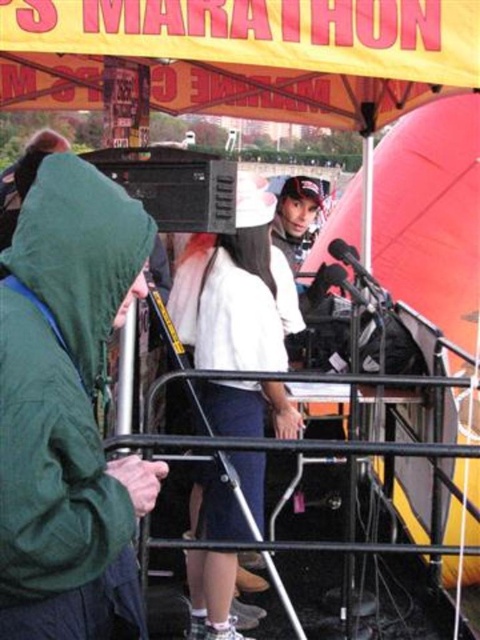
Question: Which point is farther to the camera?

Choices:
 (A) (284, 349)
 (B) (120, 218)

Answer: (A)

Question: Is green matte jacket at left smaller than white fabric shirt at center?

Choices:
 (A) no
 (B) yes

Answer: (B)

Question: Does green matte jacket at left appear on the right side of white fabric shirt at center?

Choices:
 (A) yes
 (B) no

Answer: (B)

Question: Is green matte jacket at left thinner than white fabric shirt at center?

Choices:
 (A) yes
 (B) no

Answer: (A)